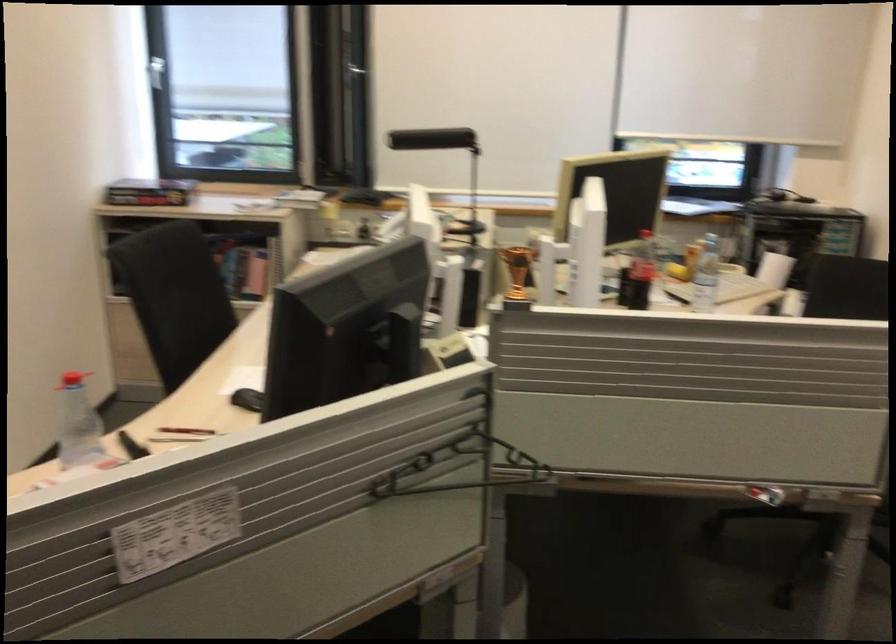
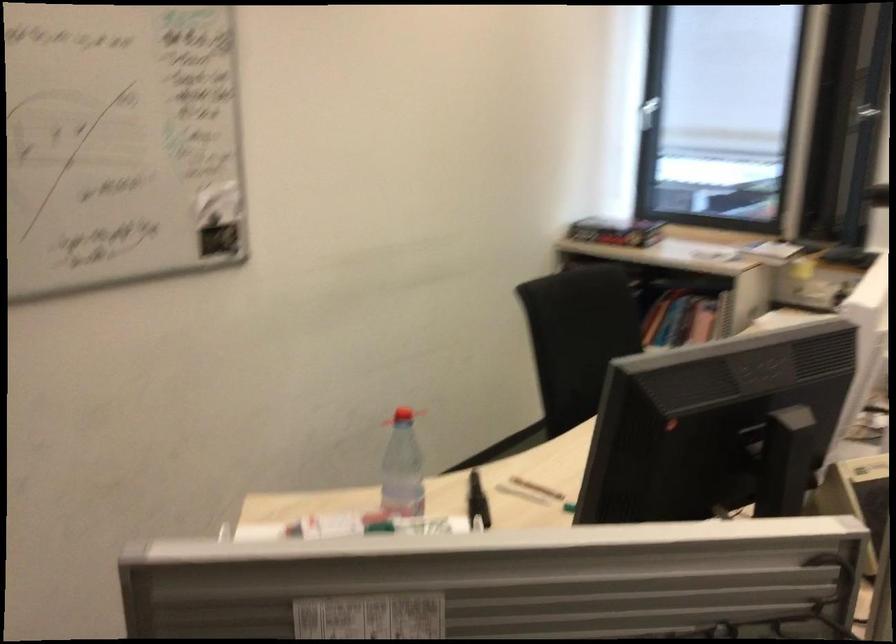
Question: The first image is from the beginning of the video and the second image is from the end. How did the camera likely rotate when shooting the video?

Choices:
 (A) Left
 (B) Right
 (C) Up
 (D) Down

Answer: (A)